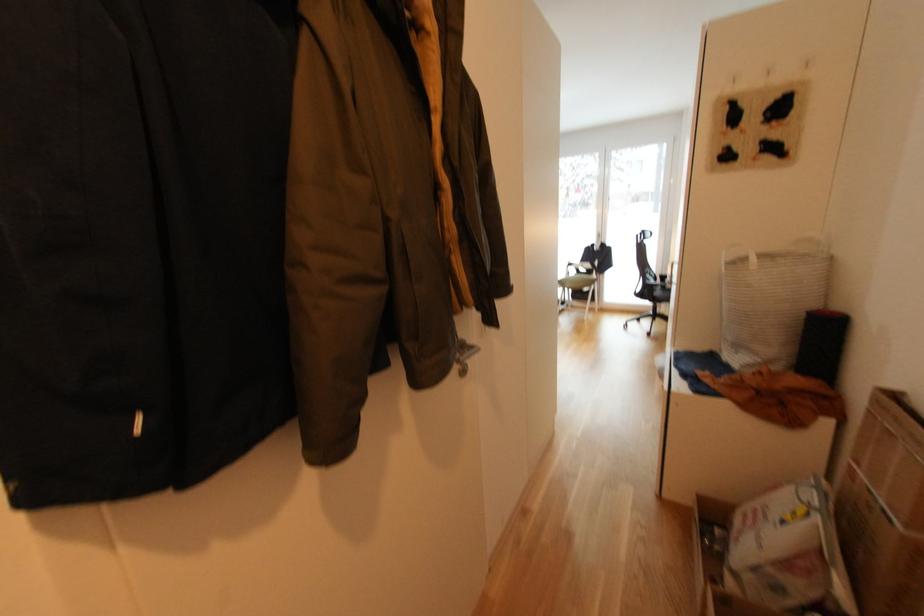
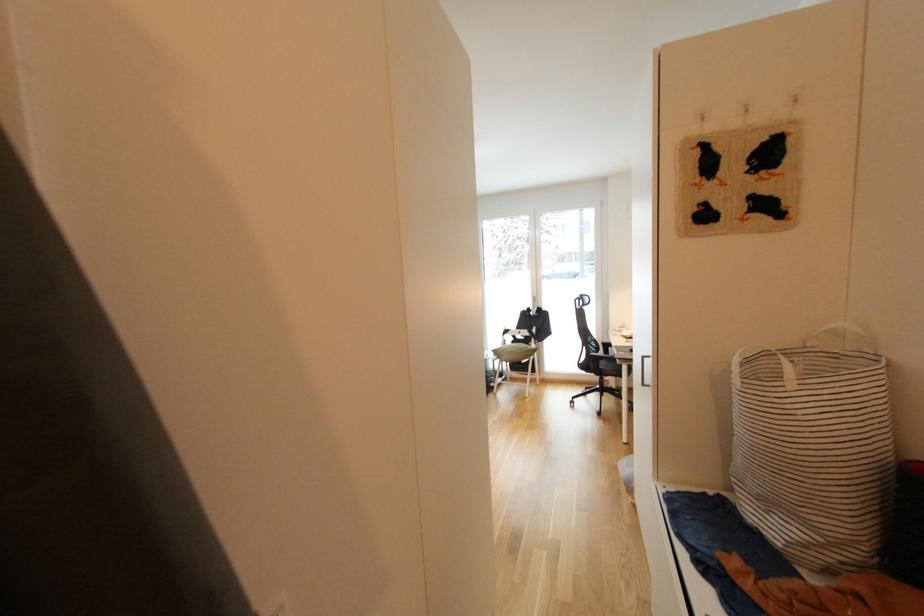
Question: The images are taken continuously from a first-person perspective. In which direction is your viewpoint rotating?

Choices:
 (A) Left
 (B) Right
 (C) Up
 (D) Down

Answer: (B)